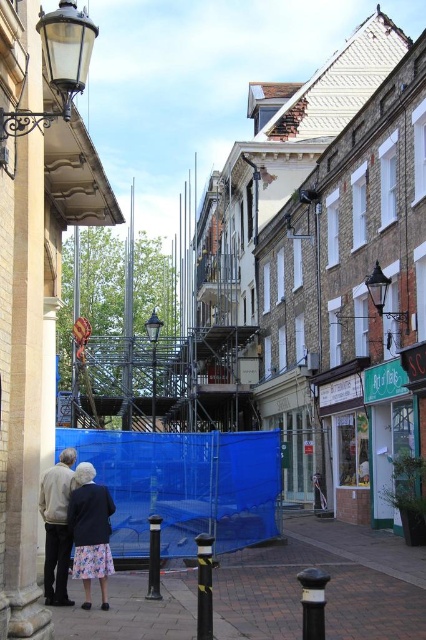
Consider the image. Which is more to the left, brick pavement at lower center or black/yellow striped pole at center?

black/yellow striped pole at center is more to the left.

Is brick pavement at lower center positioned behind black/yellow striped pole at center?

No.

Does point (411, 636) come in front of point (196, 556)?

Yes, it is.

Locate an element on the screen. The width and height of the screenshot is (426, 640). brick pavement at lower center is located at coordinates (328, 586).

Does brick pavement at lower center appear on the left side of matte black lamp post at upper left?

In fact, brick pavement at lower center is to the right of matte black lamp post at upper left.

The image size is (426, 640). Identify the location of brick pavement at lower center. (328, 586).

Which of these two, brick pavement at lower center or light gray sweater at lower left, stands shorter?

Standing shorter between the two is light gray sweater at lower left.

Does point (261, 625) come closer to viewer compared to point (52, 545)?

Yes, it is in front of point (52, 545).

The width and height of the screenshot is (426, 640). I want to click on brick pavement at lower center, so click(328, 586).

At what (x,y) coordinates should I click in order to perform the action: click on brick pavement at lower center. Please return your answer as a coordinate pair (x, y). Looking at the image, I should click on (328, 586).